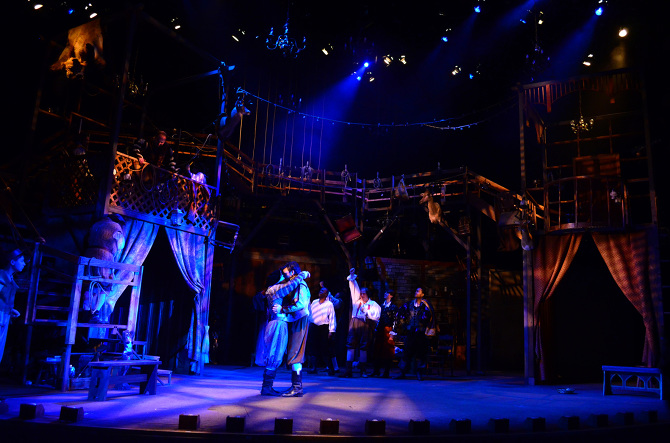
Image resolution: width=670 pixels, height=443 pixels. I want to click on curtains, so click(x=137, y=247), click(x=178, y=254).